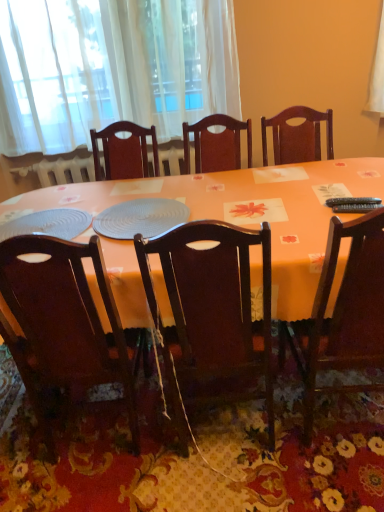
In order to click on free space to the left of black plastic remote control at right, which is counted as the 2th remote control, starting from the top in this screenshot , I will do `click(304, 217)`.